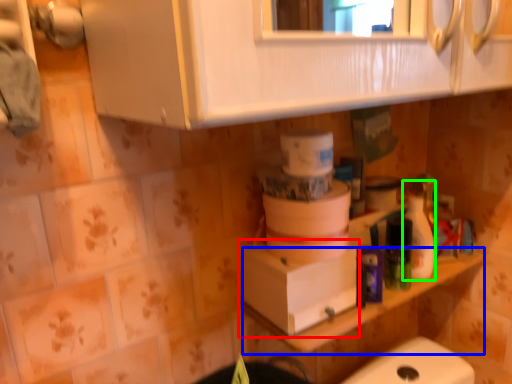
Question: Considering the real-world distances, which object is closest to cardboard box (highlighted by a red box)? counter top (highlighted by a blue box) or cleaning product (highlighted by a green box).

Choices:
 (A) counter top
 (B) cleaning product

Answer: (A)